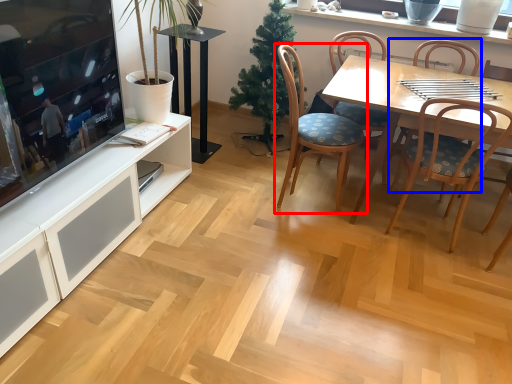
Question: Which point is further to the camera, chair (highlighted by a red box) or chair (highlighted by a blue box)?

Choices:
 (A) chair
 (B) chair

Answer: (B)